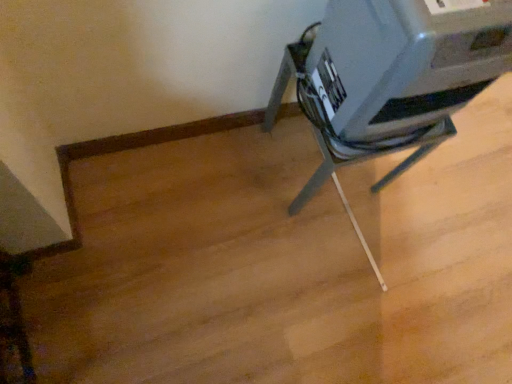
Find the location of `vacant area situated below metallic gray printer at center (from a real-world perspective)`. vacant area situated below metallic gray printer at center (from a real-world perspective) is located at coordinates (316, 165).